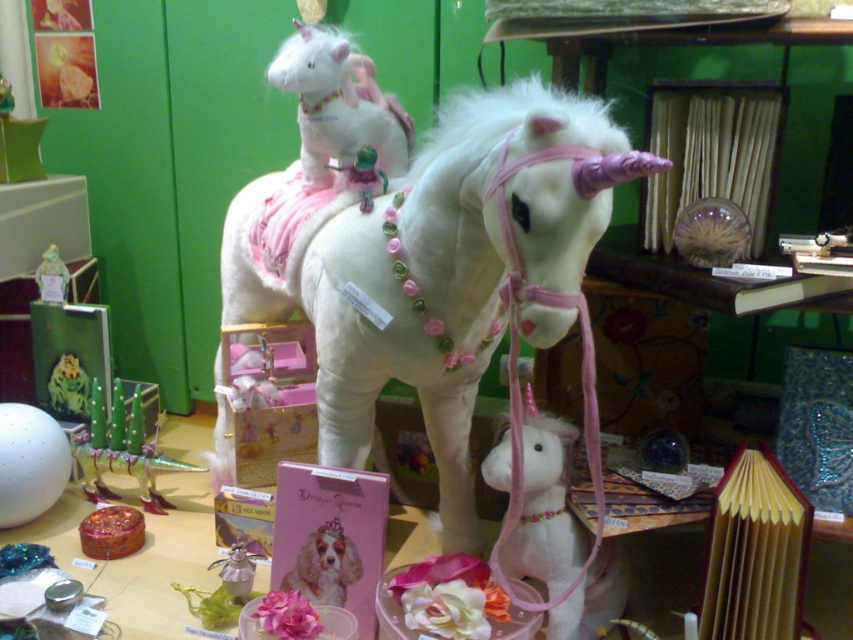
You are a customer in a gift shop and want to place both the white plush unicorn at upper left and the metallic silver figurine at center on your shelf at home. If your shelf has limited vertical space, which item should you consider removing to save height?

The white plush unicorn at upper left has a greater height compared to the metallic silver figurine at center, so you should consider removing the white plush unicorn at upper left to save vertical space.

You are designing a shelf layout and need to place both the white plush horse at center and the metallic silver toy at lower left. Which object requires more horizontal space on the shelf?

The white plush horse at center requires more horizontal space on the shelf because its width is larger than the metallic silver toy at lower left.

In the scene shown: You are arranging a themed birthday party and need to place the white plush horse at center and the matte plastic unicorn at center in a way that follows the scene setup. Which object should be placed to the right of the other?

The white plush horse at center should be placed to the right of the matte plastic unicorn at center because, according to the scene description, the white plush horse is positioned on the right side of the matte plastic unicorn.